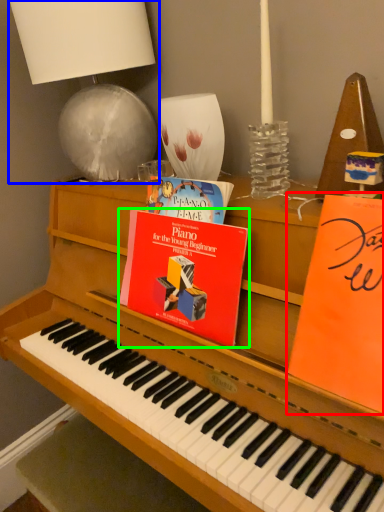
Question: Which object is positioned closest to paperback book (highlighted by a red box)? Select from table lamp (highlighted by a blue box) and paperback book (highlighted by a green box).

Choices:
 (A) table lamp
 (B) paperback book

Answer: (B)